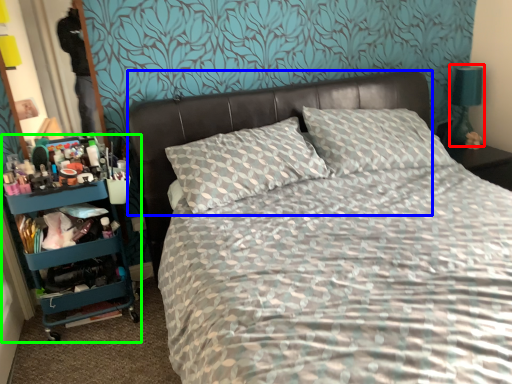
Question: Which is nearer to the bedside lamp (highlighted by a red box)? headboard (highlighted by a blue box) or bookshelf (highlighted by a green box).

Choices:
 (A) headboard
 (B) bookshelf

Answer: (A)